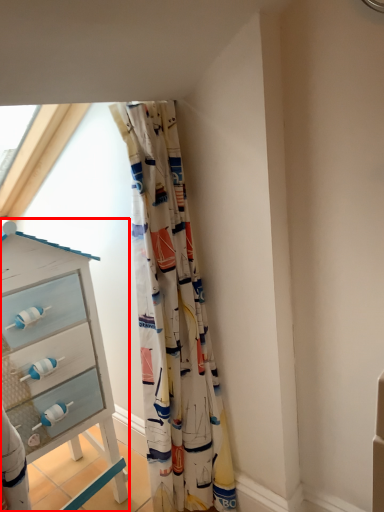
Question: From the image's perspective, where is chest of drawers (annotated by the red box) located in relation to curtain in the image?

Choices:
 (A) above
 (B) below

Answer: (B)